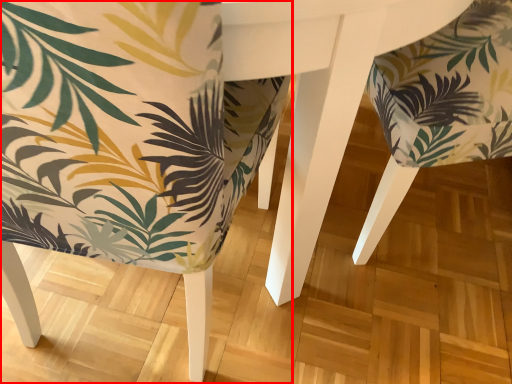
Question: Considering the relative positions of chair (annotated by the red box) and chair in the image provided, where is chair (annotated by the red box) located with respect to the staircase?

Choices:
 (A) right
 (B) left

Answer: (B)